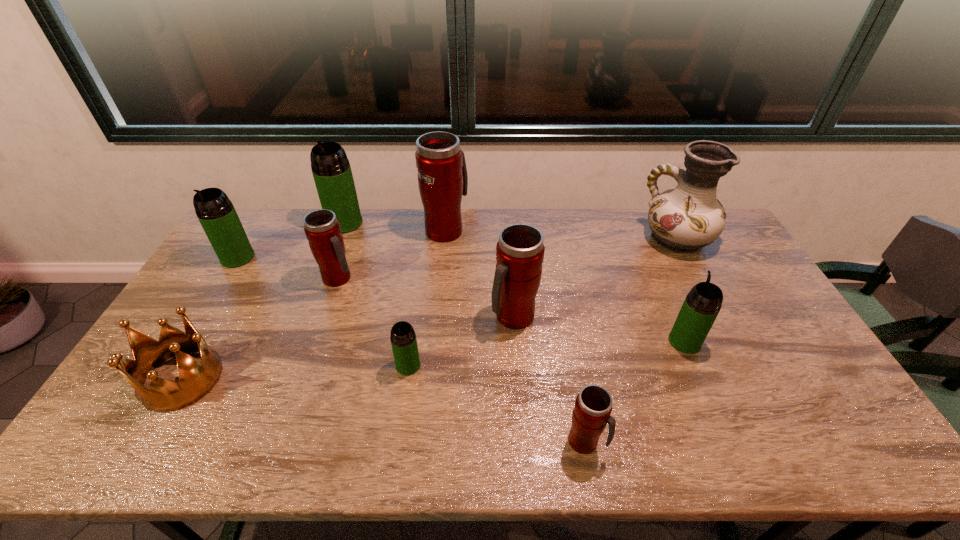
Identify the location of the third green thermos bottle from right to left. The image size is (960, 540). (331, 170).

Identify the location of the biggest green thermos bottle. (331, 170).

This screenshot has height=540, width=960. Identify the location of the farthest red thermos bottle. (442, 175).

I want to click on the biggest red thermos bottle, so click(x=442, y=175).

The height and width of the screenshot is (540, 960). Identify the location of red vase. (684, 219).

Where is `the leftmost thermos bottle`? This screenshot has width=960, height=540. the leftmost thermos bottle is located at coordinates (216, 213).

The width and height of the screenshot is (960, 540). Find the location of `the second biggest green thermos bottle`. the second biggest green thermos bottle is located at coordinates (216, 213).

Where is `the second biggest red thermos bottle`? The width and height of the screenshot is (960, 540). the second biggest red thermos bottle is located at coordinates (520, 250).

In order to click on the third farthest red thermos bottle in this screenshot , I will do `click(520, 250)`.

Locate an element on the screen. the rightmost thermos bottle is located at coordinates (702, 304).